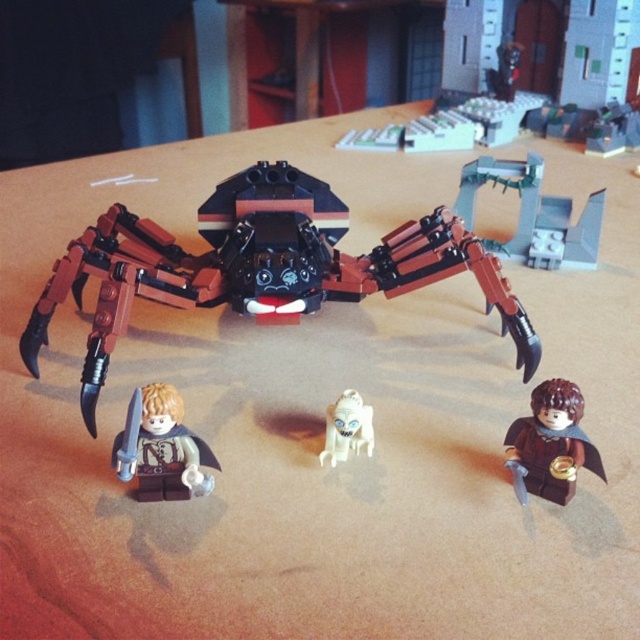
Question: Is gray metallic structure at upper right thinner than brown matte minifigure at lower right?

Choices:
 (A) yes
 (B) no

Answer: (B)

Question: Can you confirm if brick-like spider at center is positioned to the right of white matte ghost at center?

Choices:
 (A) yes
 (B) no

Answer: (B)

Question: Which object is farther from the camera taking this photo?

Choices:
 (A) white matte ghost at center
 (B) wooden table at upper center
 (C) smooth plastic minifigure at lower left
 (D) brick-like spider at center

Answer: (B)

Question: Which object is farther from the camera taking this photo?

Choices:
 (A) wooden table at upper center
 (B) smooth plastic minifigure at lower left
 (C) gray metallic structure at upper right
 (D) white matte ghost at center

Answer: (A)

Question: Is smooth plastic minifigure at lower left further to the viewer compared to white matte ghost at center?

Choices:
 (A) no
 (B) yes

Answer: (A)

Question: Which object appears closest to the camera in this image?

Choices:
 (A) brown matte minifigure at lower right
 (B) gray metallic structure at upper right
 (C) white matte ghost at center

Answer: (A)